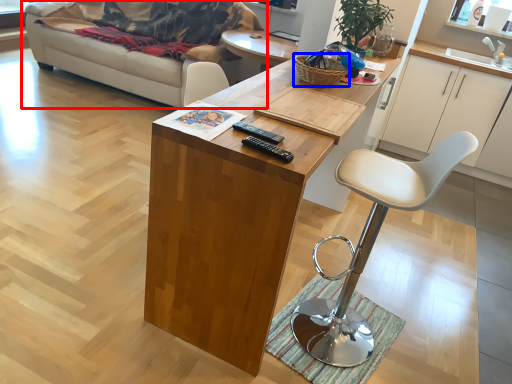
Question: Which object appears farthest to the camera in this image, studio couch (highlighted by a red box) or basket (highlighted by a blue box)?

Choices:
 (A) studio couch
 (B) basket

Answer: (A)